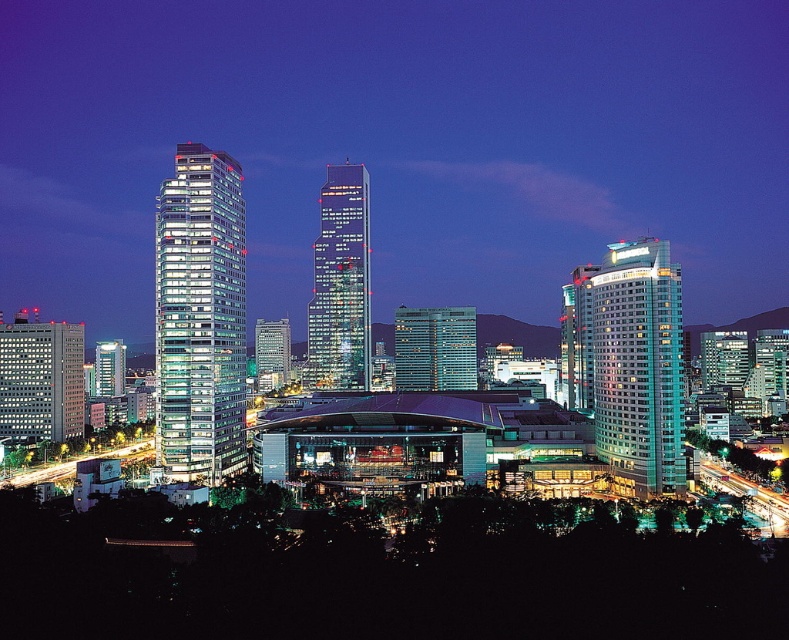
You are an architect evaluating the cityscape. You notice the glassy modern skyscraper at left and the matte glass skyscraper at left. Which one is bigger in size?

The glassy modern skyscraper at left is larger in size compared to the matte glass skyscraper at left.

You are a city planner who needs to install a new streetlight between the glassy modern skyscraper at left and the matte glass skyscraper at left. The streetlight requires a minimum of 60 meters of space between the two buildings to be installed safely. Based on the scene, can the streetlight be placed there?

The distance between the glassy modern skyscraper at left and the matte glass skyscraper at left is 58.58 meters, which is less than the required 60 meters. Therefore, the streetlight cannot be safely installed between them.

You are a drone operator tasked with capturing aerial footage of the city. Your drone is currently at coordinates 0.5, 0.5. You need to adjust its position to focus on the glass skyscraper at center. Should you move the drone north or south to align it with the skyscraper?

The glass skyscraper at center is located at point (x=339, y=285). Since your current position is (x=394, y=320), you should move the drone south to align it with the skyscraper because the skyscraper is slightly south of your current position.